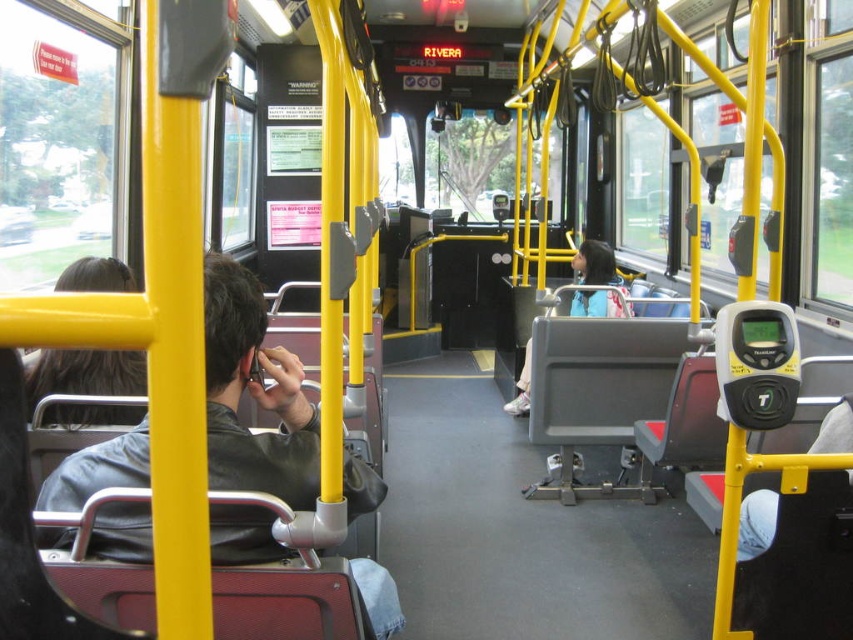
You are standing at the entrance of the bus and want to ask the person with dark brown hair at left for directions. Which direction should you walk to approach them?

The dark brown hair at left is located at point [85,372], so you should walk towards the left side of the bus to approach them.

You are a passenger on a public bus and notice two jackets. The leather jacket at left and the light blue jacket at center. Which jacket is closer to the front of the bus?

The leather jacket at left is closer to the front of the bus because it is in front of the light blue jacket at center.

You are a passenger on a public bus and want to take a photo of the two points mentioned. Which point, point (122, 372) or point (602, 243), is closer to you?

Point (122, 372) is closer to you than point (602, 243).